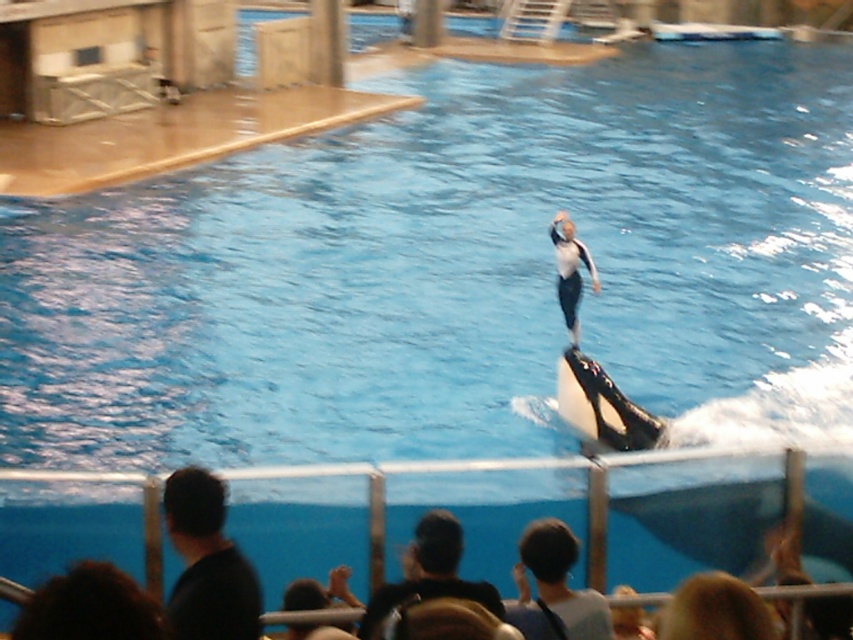
You are a photographer trying to capture the marine mammal show. You notice the black matte wetsuit at lower left and the blonde hair at lower right. Which object is wider in the image?

The black matte wetsuit at lower left is wider than the blonde hair at lower right.

You are a photographer at the zoo and need to capture a clear shot of both the black matte wetsuit at lower left and the brown hair at lower left. Based on their positions, which object should you focus on first to ensure both are in frame?

The black matte wetsuit at lower left is located above brown hair at lower left. To ensure both are in frame, focus on the black matte wetsuit at lower left first as it is higher up, allowing the camera to capture the lower positioned brown hair at lower left in the same shot.